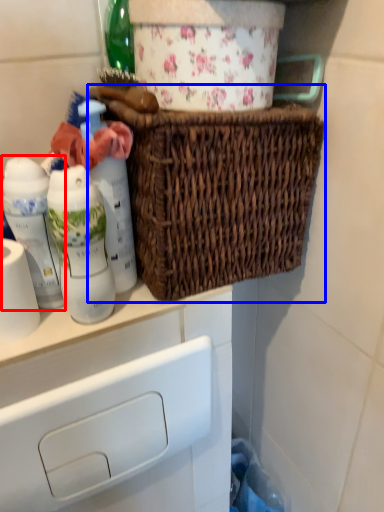
Question: Which of the following is the closest to the observer, bottle (highlighted by a red box) or picnic basket (highlighted by a blue box)?

Choices:
 (A) bottle
 (B) picnic basket

Answer: (B)